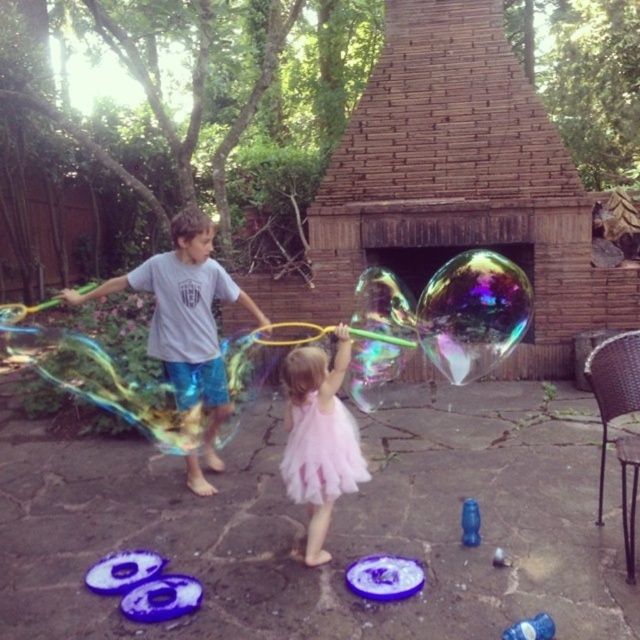
You are a parent supervising the children. You notice the pink tulle dress at center and the blue plastic toy at lower center on the ground. Which item is wider?

The pink tulle dress at center is wider than the blue plastic toy at lower center.